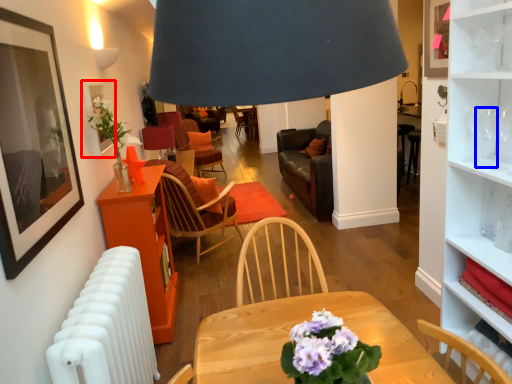
Question: Which object appears closest to the camera in this image, picture frame (highlighted by a red box) or wine glass (highlighted by a blue box)?

Choices:
 (A) picture frame
 (B) wine glass

Answer: (B)